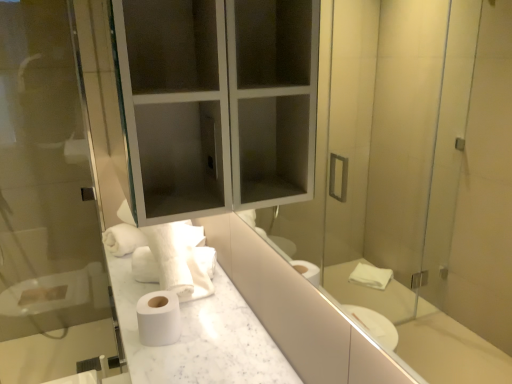
The width and height of the screenshot is (512, 384). I want to click on unoccupied space behind white matte toilet paper at center, so click(177, 306).